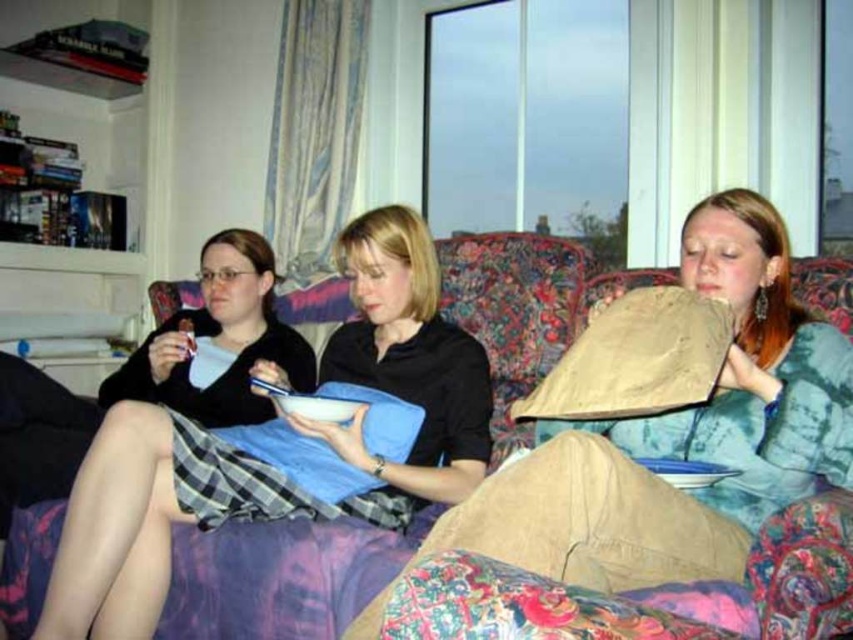
You are arranging a small party and want to place a decorative bowl on the table. However, you notice the floral fabric couch at center and the white matte bowl at center are in the way. Which object should you move to access the table?

The white matte bowl at center should be moved because the floral fabric couch at center is positioned over it, making it inaccessible without moving the couch first.

You are standing in the room and want to move from the point at coordinates point [824,310] to the point at coordinates point [190,342]. Which direction should you move?

You should move backward because point [824,310] is in front of point [190,342], so moving backward will take you towards the latter point.